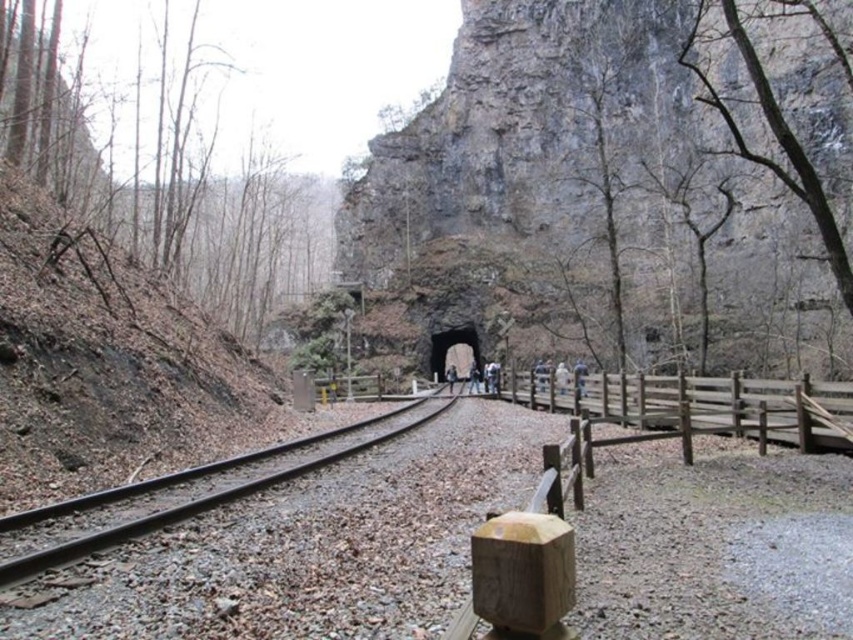
Which of these two, gray rock formation at center or smooth metal train track at center, stands taller?

gray rock formation at center

Does gray rock formation at center have a lesser height compared to smooth metal train track at center?

In fact, gray rock formation at center may be taller than smooth metal train track at center.

At what (x,y) coordinates should I click in order to perform the action: click on gray rock formation at center. Please return your answer as a coordinate pair (x, y). The image size is (853, 640). Looking at the image, I should click on (624, 182).